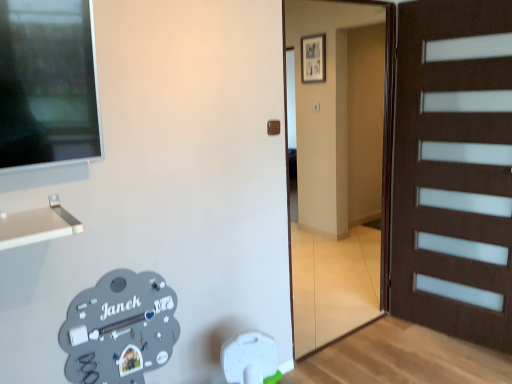
Question: Is brown wooden door at center located outside brown matte door handle at center?

Choices:
 (A) yes
 (B) no

Answer: (A)

Question: Is brown wooden door at center wider than brown matte door handle at center?

Choices:
 (A) no
 (B) yes

Answer: (B)

Question: From a real-world perspective, is brown wooden door at center located higher than brown matte door handle at center?

Choices:
 (A) no
 (B) yes

Answer: (A)

Question: Is brown wooden door at center positioned before brown matte door handle at center?

Choices:
 (A) yes
 (B) no

Answer: (A)

Question: Does brown wooden door at center have a lesser height compared to brown matte door handle at center?

Choices:
 (A) yes
 (B) no

Answer: (B)

Question: Considering the relative positions of brown wooden door at center and brown matte door handle at center in the image provided, is brown wooden door at center to the right of brown matte door handle at center from the viewer's perspective?

Choices:
 (A) no
 (B) yes

Answer: (B)

Question: Can you confirm if brown matte door handle at center is positioned to the right of brown wooden door at center?

Choices:
 (A) no
 (B) yes

Answer: (A)

Question: Considering the relative positions of brown matte door handle at center and brown wooden door at center in the image provided, is brown matte door handle at center behind brown wooden door at center?

Choices:
 (A) yes
 (B) no

Answer: (A)

Question: Is brown matte door handle at center smaller than brown wooden door at center?

Choices:
 (A) yes
 (B) no

Answer: (A)

Question: From a real-world perspective, is brown matte door handle at center beneath brown wooden door at center?

Choices:
 (A) no
 (B) yes

Answer: (A)

Question: Is brown matte door handle at center oriented away from brown wooden door at center?

Choices:
 (A) yes
 (B) no

Answer: (B)

Question: Considering the relative sizes of brown matte door handle at center and brown wooden door at center in the image provided, is brown matte door handle at center shorter than brown wooden door at center?

Choices:
 (A) yes
 (B) no

Answer: (A)

Question: Considering the positions of brown matte door handle at center and brown wooden door at center in the image, is brown matte door handle at center wider or thinner than brown wooden door at center?

Choices:
 (A) wide
 (B) thin

Answer: (B)